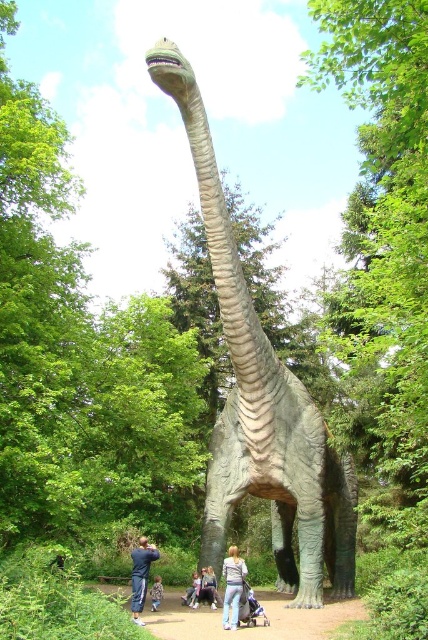
How much distance is there between green textured dinosaur at center and blue fabric baby carriage at lower center?

green textured dinosaur at center and blue fabric baby carriage at lower center are 29.69 meters apart.

Can you confirm if green textured dinosaur at center is taller than blue fabric baby carriage at lower center?

Yes, green textured dinosaur at center is taller than blue fabric baby carriage at lower center.

In order to click on green textured dinosaur at center in this screenshot , I will do `click(261, 401)`.

Is blue jeans at lower center taller than light gray fabric pants at lower center?

Indeed, blue jeans at lower center has a greater height compared to light gray fabric pants at lower center.

Locate an element on the screen. This screenshot has height=640, width=428. blue jeans at lower center is located at coordinates (140, 576).

Can you confirm if blue jeans at lower center is positioned to the right of light brown fabric pants at lower center?

In fact, blue jeans at lower center is to the left of light brown fabric pants at lower center.

Between point (139, 620) and point (157, 584), which one is positioned behind?

Positioned behind is point (157, 584).

Identify the location of blue jeans at lower center. The height and width of the screenshot is (640, 428). (140, 576).